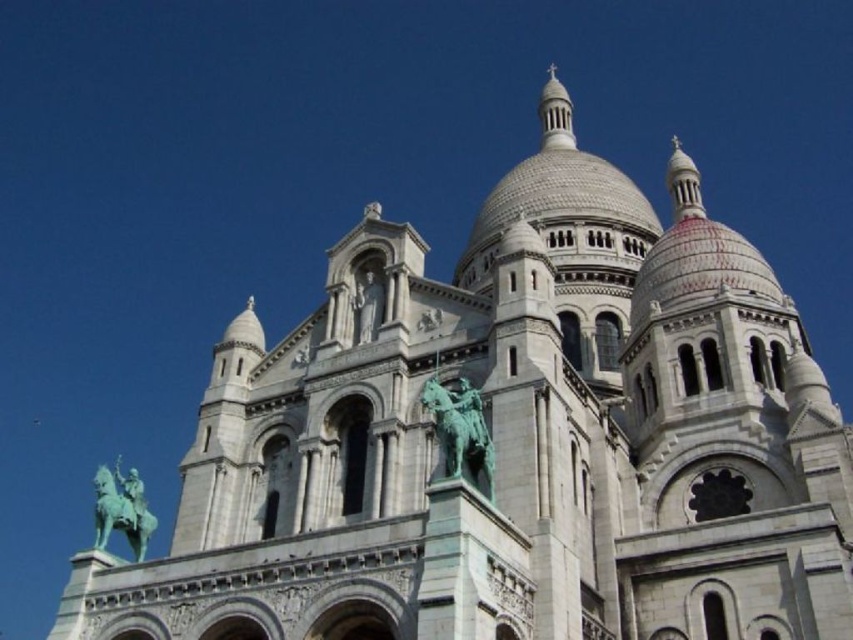
You are standing at the base of the Sacre Coeur Basilica and see two statues at the center of the facade. Which statue would appear larger to you, the green patina statue at center or the white stone statue at center?

The green patina statue at center appears larger because it is closer to the viewer than the white stone statue at center.

You are standing at the base of the Basilica of the Sacred Heart of Paris. You see the green patina statue at center. If you walk 100 feet towards the statue, how far will you be from it?

The green patina statue at center is initially 139.05 feet away. After walking 100 feet towards it, the remaining distance would be 139.05 minus 100, which equals 39.05 feet.

You are an art student analyzing the statues on the facade of the Basilica of the Sacred Heart of Paris. You observe the green patina statue at center and the white stone statue at center. Which statue has a greater width according to the description?

The green patina statue at center might be wider than white stone statue at center.